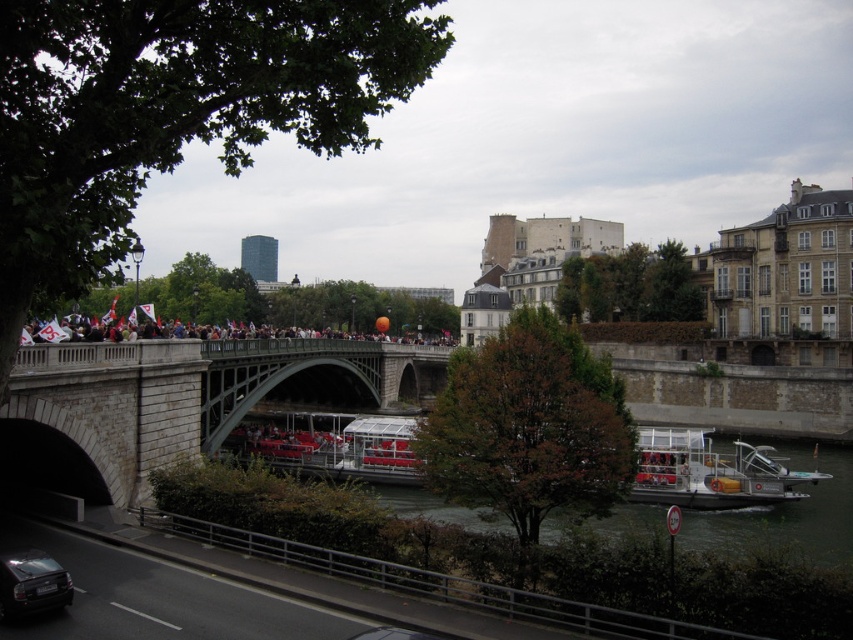
Is stone bridge at center behind shiny black car at lower left?

Yes, stone bridge at center is further from the viewer.

What do you see at coordinates (196, 394) in the screenshot? This screenshot has height=640, width=853. I see `stone bridge at center` at bounding box center [196, 394].

Where is `stone bridge at center`? The width and height of the screenshot is (853, 640). stone bridge at center is located at coordinates (196, 394).

Is stone bridge at center wider than silver metallic boat at lower right?

Indeed, stone bridge at center has a greater width compared to silver metallic boat at lower right.

From the picture: Who is higher up, stone bridge at center or silver metallic boat at lower right?

stone bridge at center

Is point (299, 372) in front of point (677, 468)?

That is False.

This screenshot has height=640, width=853. In order to click on stone bridge at center in this screenshot , I will do [x=196, y=394].

Between silver metallic boat at lower right and shiny black car at lower left, which one is positioned lower?

Positioned lower is silver metallic boat at lower right.

Who is taller, silver metallic boat at lower right or shiny black car at lower left?

Standing taller between the two is silver metallic boat at lower right.

Identify the location of silver metallic boat at lower right. Image resolution: width=853 pixels, height=640 pixels. (709, 472).